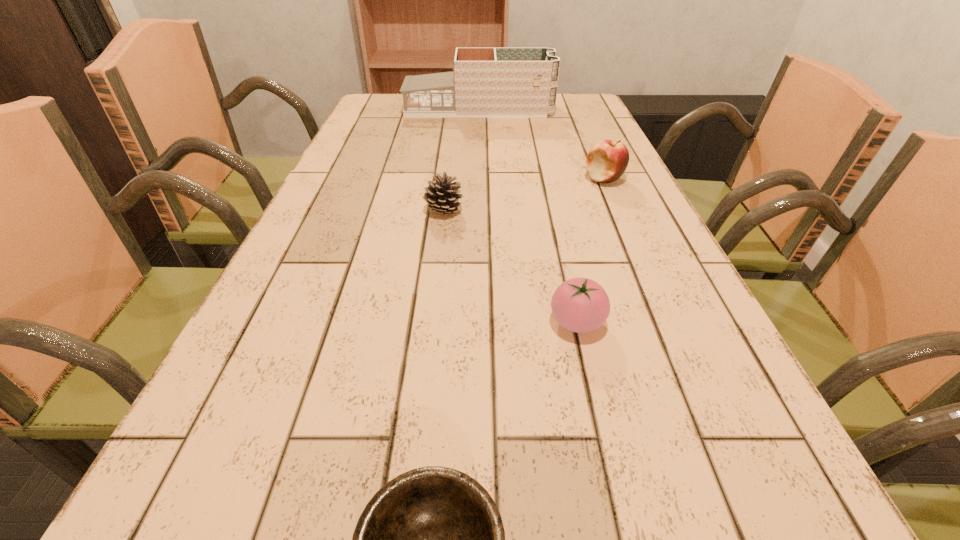
Where is `object that is at the far edge`? Image resolution: width=960 pixels, height=540 pixels. object that is at the far edge is located at coordinates (485, 82).

The height and width of the screenshot is (540, 960). Identify the location of object present at the left edge. (485, 82).

Where is `dollhouse that is at the right edge`? This screenshot has width=960, height=540. dollhouse that is at the right edge is located at coordinates (485, 82).

This screenshot has height=540, width=960. I want to click on apple situated at the right edge, so click(607, 160).

At what (x,y) coordinates should I click in order to perform the action: click on object that is at the far left corner. Please return your answer as a coordinate pair (x, y). This screenshot has height=540, width=960. Looking at the image, I should click on (485, 82).

I want to click on object that is at the far right corner, so click(x=485, y=82).

Locate an element on the screen. The width and height of the screenshot is (960, 540). vacant area at the far edge is located at coordinates (482, 120).

Identify the location of vacant space at the left edge of the desktop. (351, 228).

In the image, there is a desktop. Where is `vacant space at the right edge`? Image resolution: width=960 pixels, height=540 pixels. vacant space at the right edge is located at coordinates (670, 399).

The image size is (960, 540). Find the location of `free space at the far left corner of the desktop`. free space at the far left corner of the desktop is located at coordinates coord(379,97).